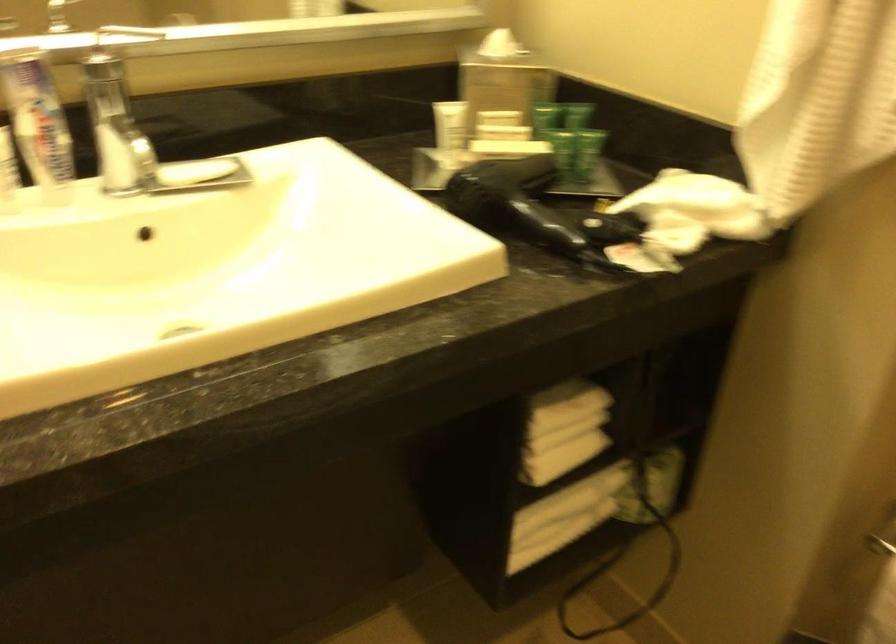
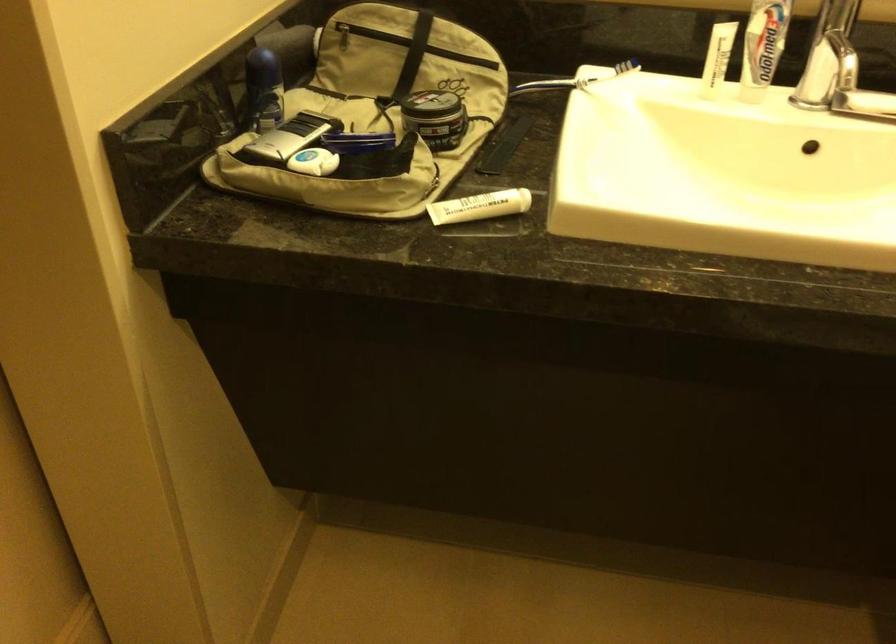
Question: The camera is either moving clockwise (left) or counter-clockwise (right) around the object. The first image is from the beginning of the video and the second image is from the end. Is the camera moving left or right when shooting the video?

Choices:
 (A) Left
 (B) Right

Answer: (B)